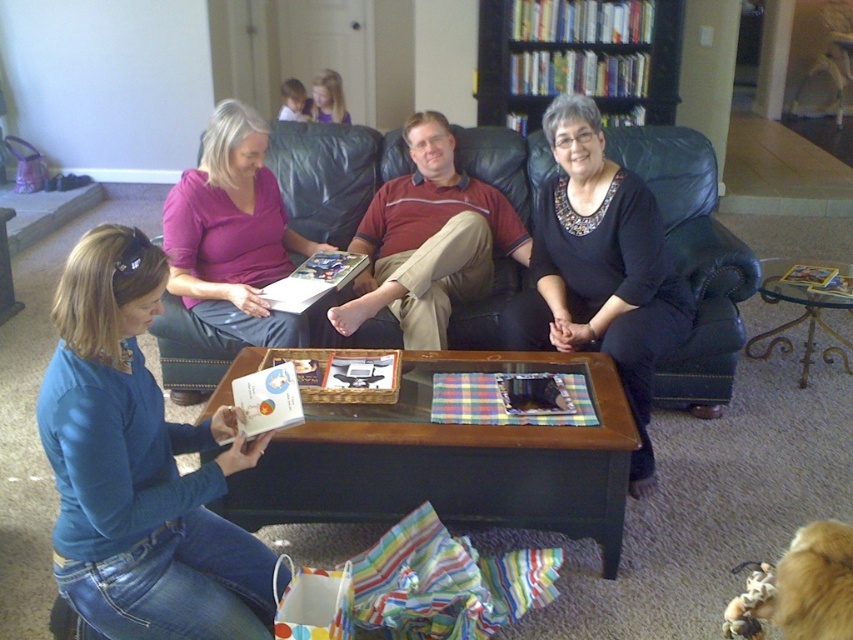
You are a fashion designer who wants to display a black matte dress at center and a black wood bookshelf at upper center in a store window. Which item should be placed lower to ensure both are visible to passersby?

The black wood bookshelf at upper center should be placed lower because the black matte dress at center is taller, allowing both items to be visible when arranged appropriately.

You are a delivery person entering the living room and need to place a large package on the floor. The package is 2 meters wide. You see the blue denim jeans at lower left and the leather couch at center. Which object, if any, can the package be placed next to without overlapping?

The blue denim jeans at lower left is wider than the leather couch at center. Since the package is 2 meters wide, it can be placed next to either object as their widths do not restrict the package placement. However, the blue denim jeans at lower left has a greater width, so placing the package next to it might provide more space. But since the question is about not overlapping, the exact widths aren